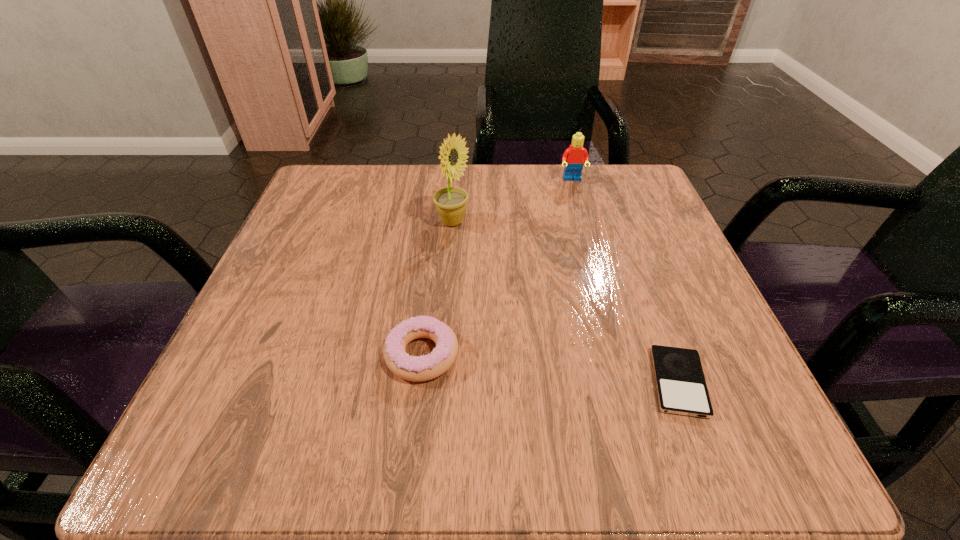
The image size is (960, 540). I want to click on vacant region that satisfies the following two spatial constraints: 1. on the back side of the iPod; 2. on the face of the sunflower, so click(618, 222).